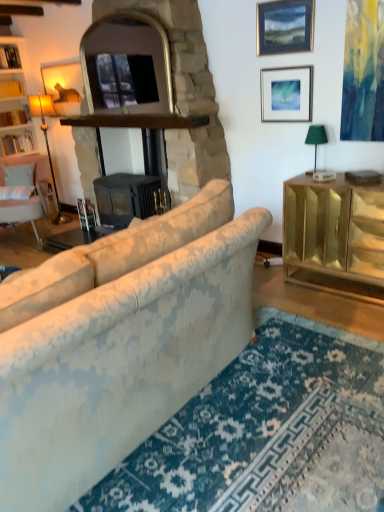
The width and height of the screenshot is (384, 512). I want to click on vacant space underneath matte gold floor lamp at left, arranged as the 2th lamp when viewed from the front (from a real-world perspective), so click(x=62, y=222).